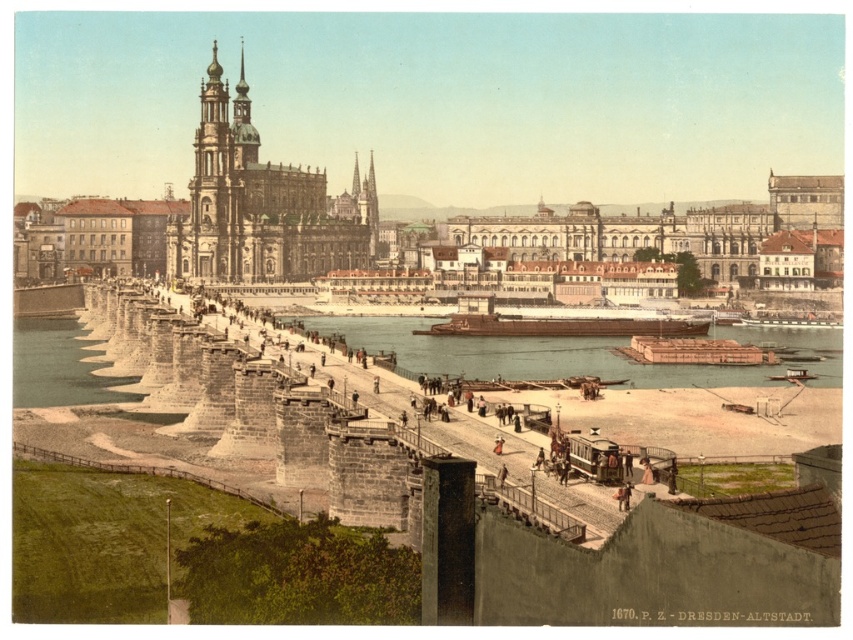
From the picture: Is brown wooden boats at center smaller than brown wooden raft at lower right?

Actually, brown wooden boats at center might be larger than brown wooden raft at lower right.

Is brown wooden boats at center positioned behind brown wooden raft at lower right?

That is False.

Locate an element on the screen. brown wooden boats at center is located at coordinates (579, 353).

Can you confirm if golden ornate tower at upper left is bigger than brown matte barge at center?

Correct, golden ornate tower at upper left is larger in size than brown matte barge at center.

Between point (221, 218) and point (412, 330), which one is positioned behind?

Positioned behind is point (221, 218).

Does point (318, 196) lie in front of point (459, 330)?

No, it is not.

Identify the location of golden ornate tower at upper left. This screenshot has height=640, width=853. (258, 205).

Can you confirm if golden ornate tower at upper left is positioned to the right of brown wooden boats at center?

In fact, golden ornate tower at upper left is to the left of brown wooden boats at center.

Which is more to the left, golden ornate tower at upper left or brown wooden boats at center?

Positioned to the left is golden ornate tower at upper left.

The height and width of the screenshot is (640, 853). Identify the location of golden ornate tower at upper left. (258, 205).